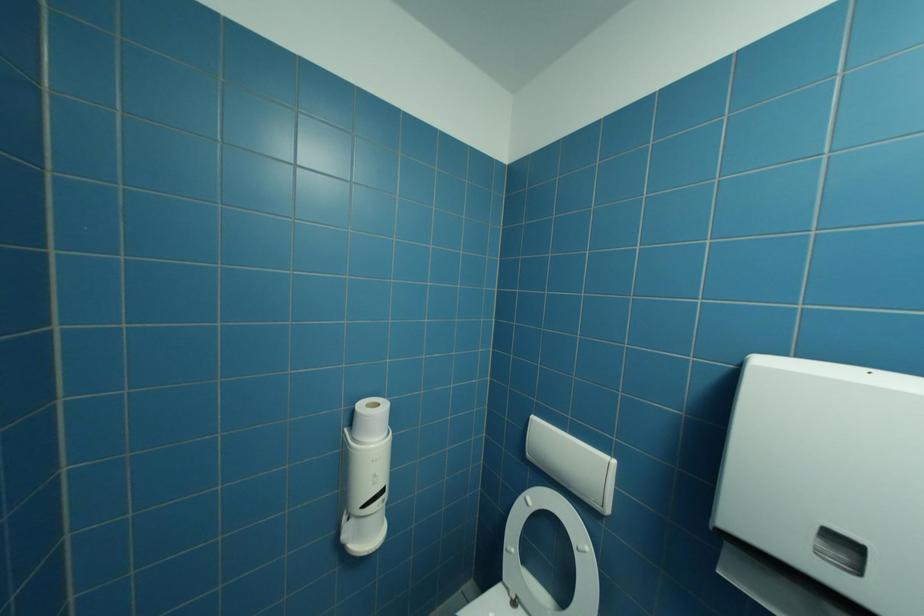
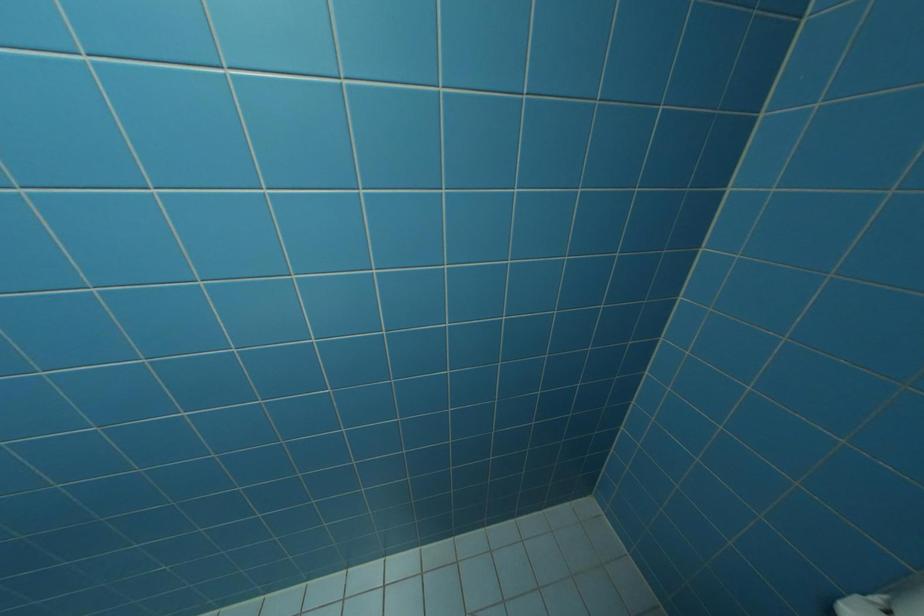
How did the camera likely rotate?

The camera's rotation is toward left-down.